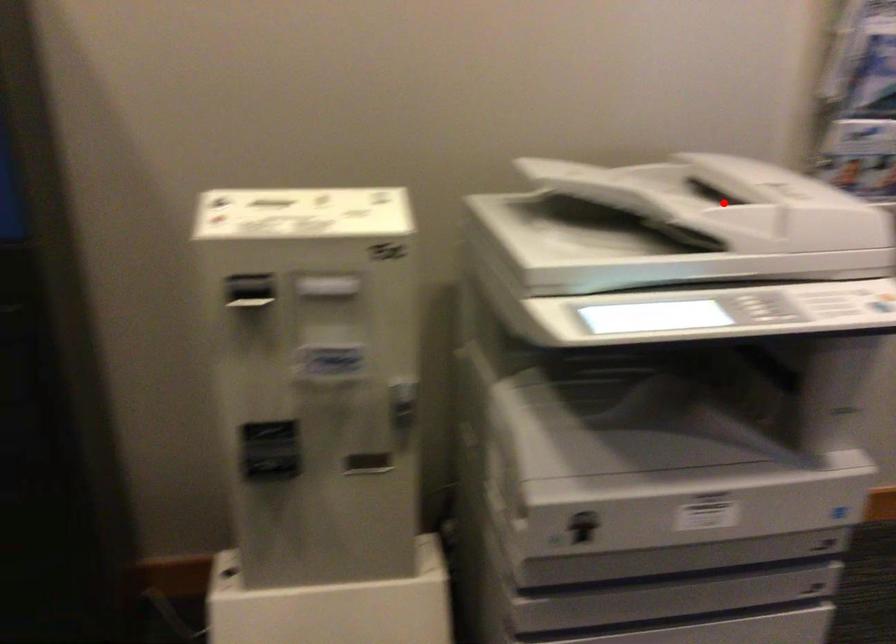
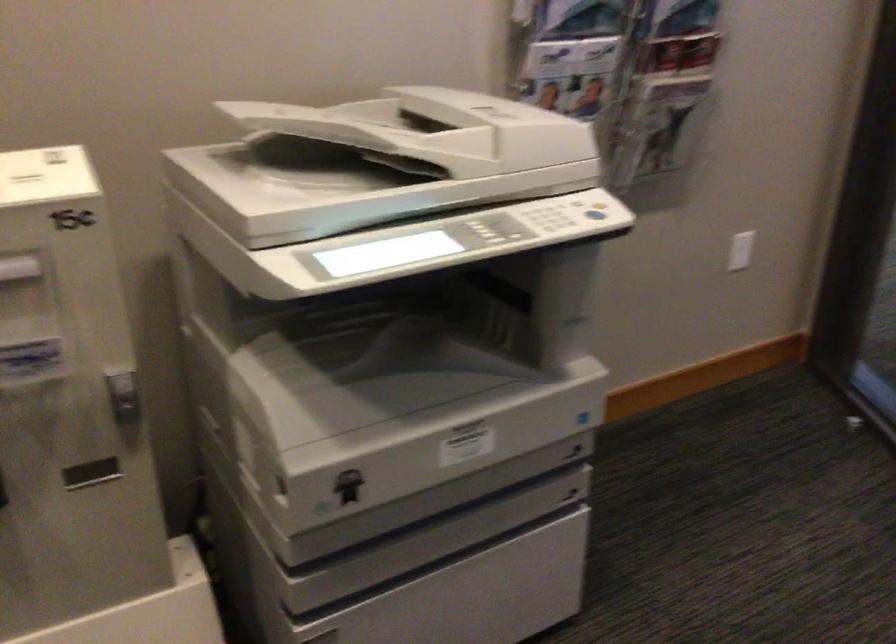
Question: I am providing you with two images of the same scene from different viewpoints. A red point is marked on the first image. Can you still see the location of the red point in image 2?

Choices:
 (A) Yes
 (B) No

Answer: (B)